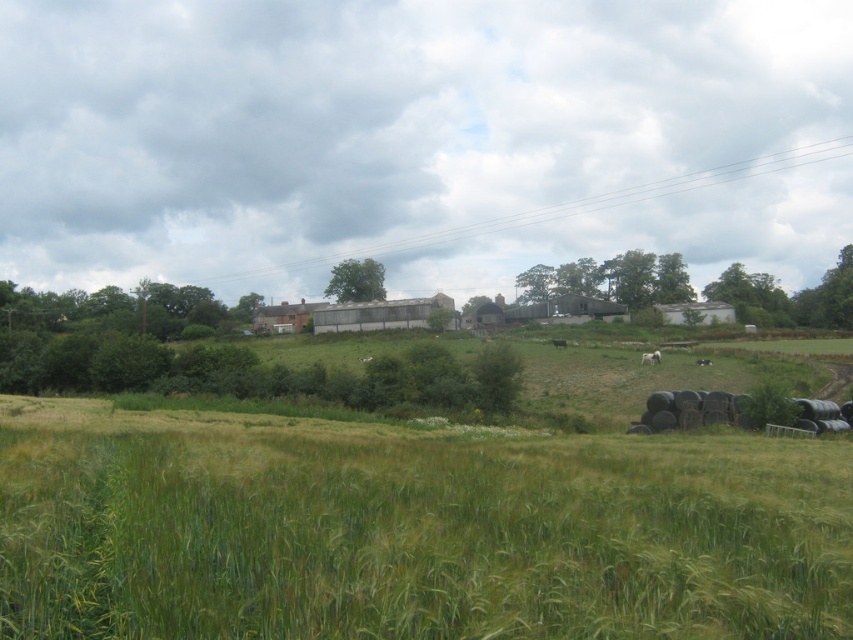
You are standing in the rural landscape and want to place a small flag at each of the two points, point (x=469, y=467) and point (x=697, y=362). Which point will require you to walk further to reach?

Point (x=697, y=362) will require you to walk further because it is farther from the viewer compared to point (x=469, y=467).

Based on the photo, you are standing at the top of a hill overlooking the rural landscape. You see the green grassy wheat field at lower center and the white fluffy sheep at lower right. Which object is positioned lower in the scene?

The green grassy wheat field at lower center is positioned lower than the white fluffy sheep at lower right.